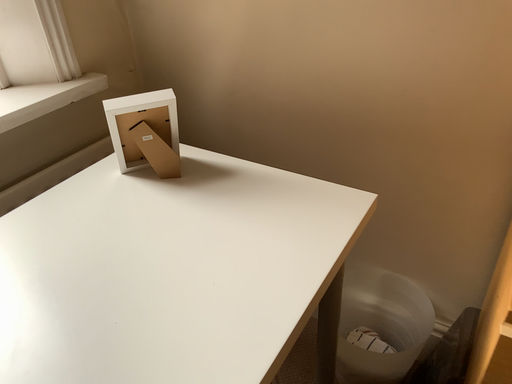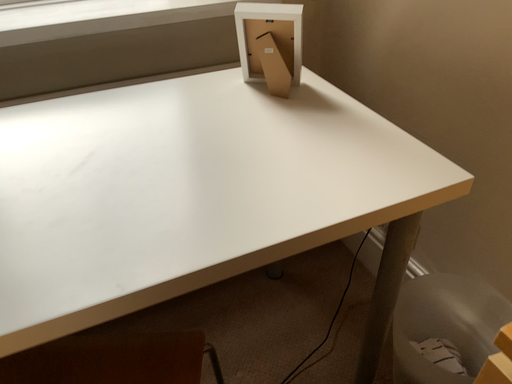
Question: Which way did the camera rotate in the video?

Choices:
 (A) rotated right
 (B) rotated left

Answer: (B)